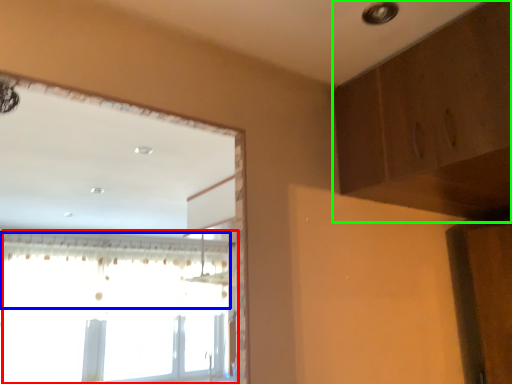
Question: Which is nearer to the window (highlighted by a red box)? curtain (highlighted by a blue box) or dresser (highlighted by a green box).

Choices:
 (A) curtain
 (B) dresser

Answer: (A)